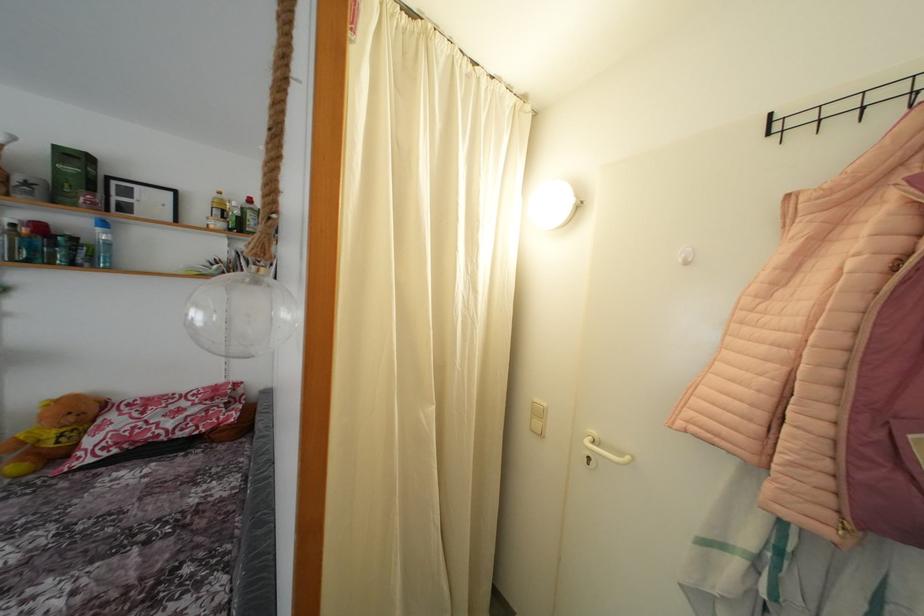
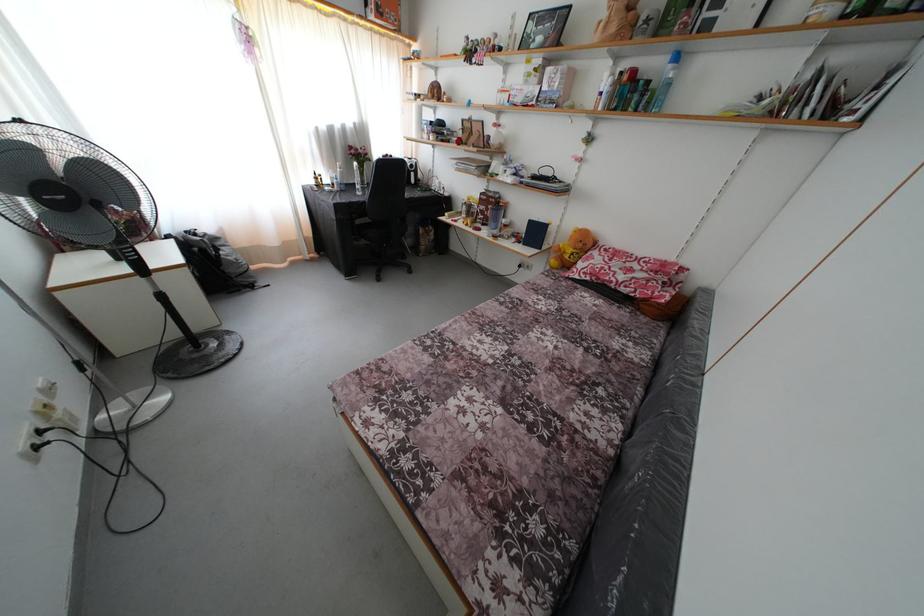
Find the pixel in the second image that matches point (104, 236) in the first image.

(675, 73)